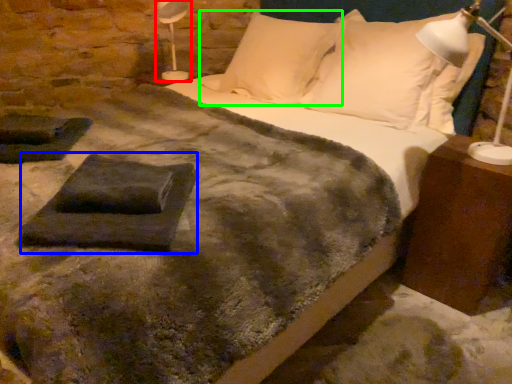
Question: Estimate the real-world distances between objects in this image. Which object is farther from table lamp (highlighted by a red box), slate (highlighted by a blue box) or pillow (highlighted by a green box)?

Choices:
 (A) slate
 (B) pillow

Answer: (A)